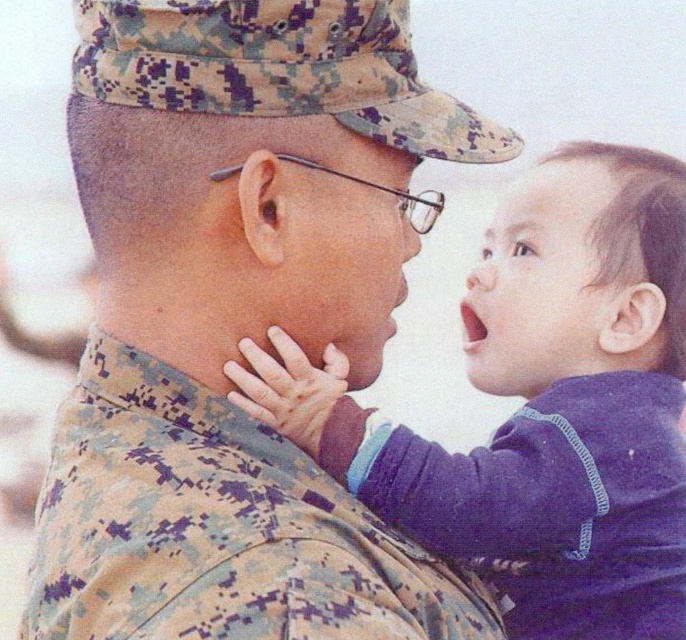
Question: Can you confirm if camouflage uniform at center is positioned above camouflage fabric at center?

Choices:
 (A) no
 (B) yes

Answer: (B)

Question: Considering the real-world distances, which object is closest to the camouflage uniform at center?

Choices:
 (A) purple fleece sleeve at center
 (B) camouflage fabric at center

Answer: (B)

Question: Where is purple fleece jacket at center located in relation to camouflage fabric at center in the image?

Choices:
 (A) above
 (B) below

Answer: (A)

Question: Based on their relative distances, which object is nearer to the camouflage fabric at center?

Choices:
 (A) purple fleece sleeve at center
 (B) camouflage uniform at center

Answer: (B)

Question: Is purple fleece jacket at center to the right of purple fleece sleeve at center from the viewer's perspective?

Choices:
 (A) yes
 (B) no

Answer: (B)

Question: Which point is farther to the camera?

Choices:
 (A) purple fleece jacket at center
 (B) camouflage fabric at center
 (C) camouflage uniform at center
 (D) purple fleece sleeve at center

Answer: (D)